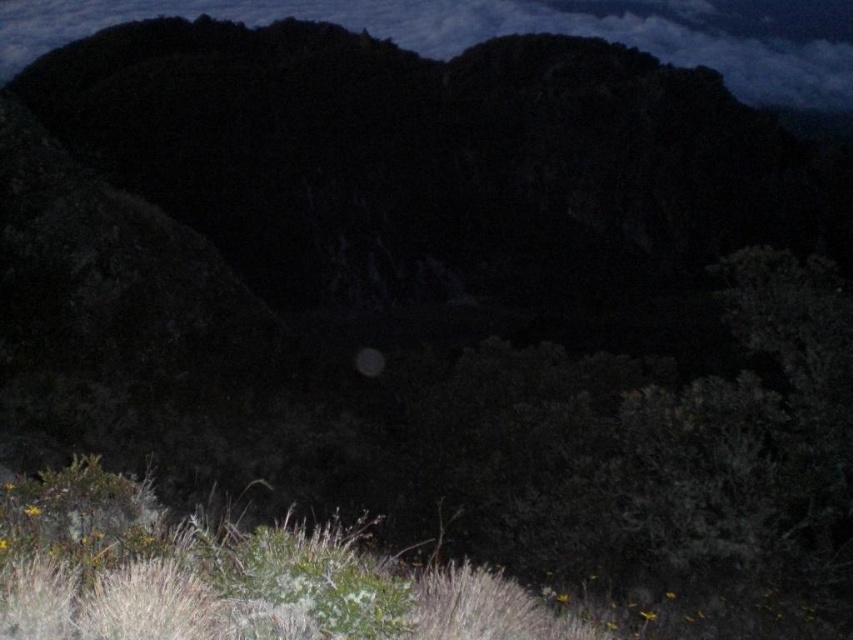
You are an astronomer trying to locate the cloudy sky at upper center in the image. According to the coordinates provided, where would you look?

The cloudy sky at upper center is located at point (521, 32).

You are a photographer setting up a tripod in this mountainous scene. You have two points marked on your camera screen at coordinates point [682,19] and point [376,349]. Which point is closer to your camera lens?

Point [376,349] is closer to the camera lens because it is less further to the camera than point [682,19].

In the scene shown: You are a hiker trying to navigate through this mountainous area. You notice a specific point marked at coordinates point [521,32]. What is located at that point?

The cloudy sky at upper center is located at point [521,32].